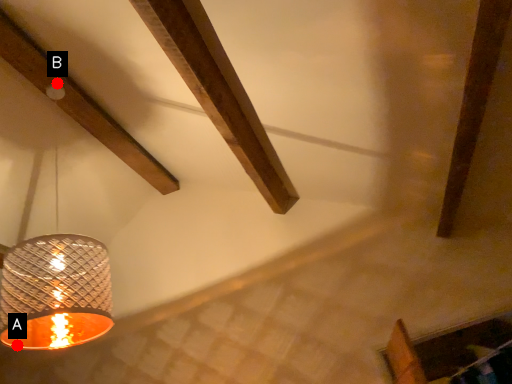
Question: Two points are circled on the image, labeled by A and B beside each circle. Which of the following is the farthest from the observer?

Choices:
 (A) A is further
 (B) B is further

Answer: (B)